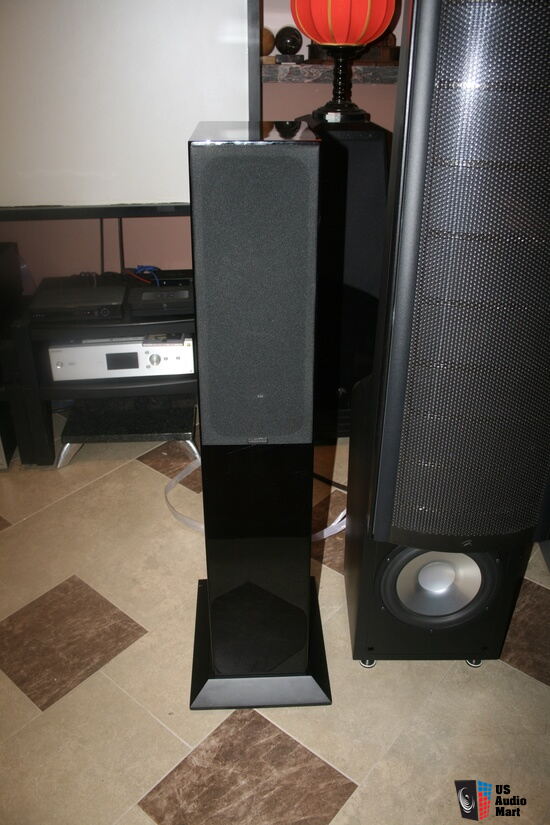
Image resolution: width=550 pixels, height=825 pixels. I want to click on speaker, so (x=467, y=639).